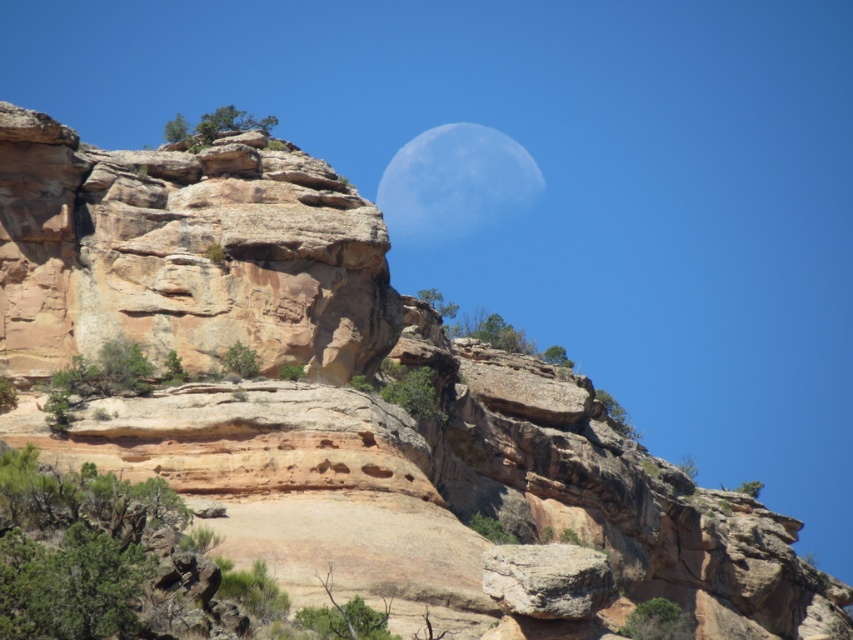
Can you confirm if rustic sandstone cliff at upper left is positioned above rustic brown rock at center?

Yes.

Can you confirm if rustic sandstone cliff at upper left is positioned to the right of rustic brown rock at center?

Incorrect, rustic sandstone cliff at upper left is not on the right side of rustic brown rock at center.

Is point (357, 310) closer to viewer compared to point (515, 598)?

No, (357, 310) is further to viewer.

Identify the location of rustic sandstone cliff at upper left. (186, 253).

From the picture: Who is taller, slightly grayish-white textured moon at upper center or rustic brown rock at center?

Standing taller between the two is slightly grayish-white textured moon at upper center.

Is point (480, 220) closer to viewer compared to point (590, 557)?

That is False.

This screenshot has height=640, width=853. I want to click on slightly grayish-white textured moon at upper center, so click(456, 182).

Where is `rustic sandstone cliff at upper left`? rustic sandstone cliff at upper left is located at coordinates (186, 253).

Describe the element at coordinates (186, 253) in the screenshot. The width and height of the screenshot is (853, 640). I see `rustic sandstone cliff at upper left` at that location.

At what (x,y) coordinates should I click in order to perform the action: click on rustic sandstone cliff at upper left. Please return your answer as a coordinate pair (x, y). Looking at the image, I should click on (186, 253).